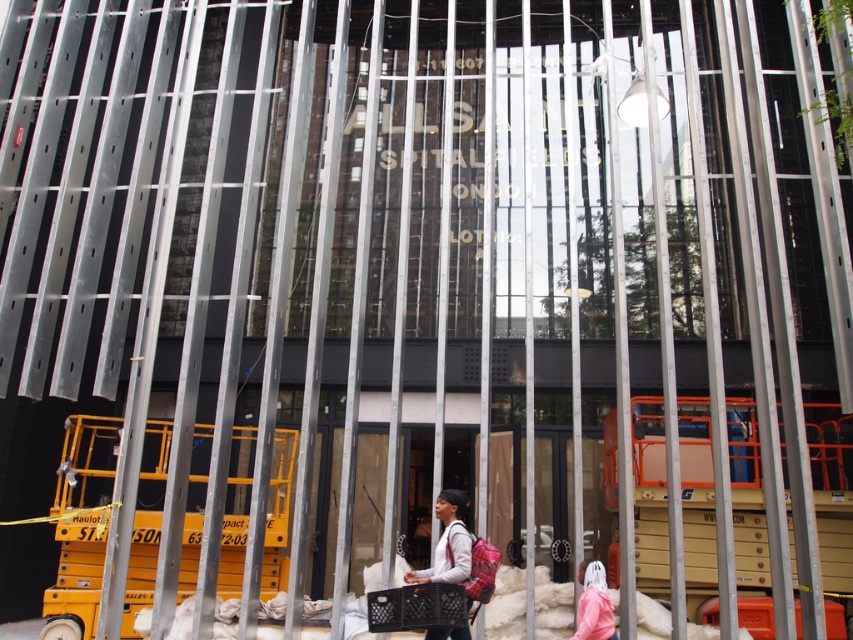
You are a delivery person who needs to carry a plaid fabric backpack at center and a pink fabric at lower right. Which item should you pick if you want to carry the smaller one?

The plaid fabric backpack at center is smaller than the pink fabric at lower right, so you should pick the plaid fabric backpack at center.

You are a worker at the construction site and need to place a tool box on the ground. You see a plaid fabric backpack at center and a pink fabric at lower right. Which surface would you choose to place the tool box if you want it to be higher off the ground?

The plaid fabric backpack at center is shorter than the pink fabric at lower right, so placing the tool box on the pink fabric at lower right would result in it being higher off the ground.

You are a worker on the construction site and need to carry your tools. You have a plaid fabric backpack at center and a pink fabric at lower right. Which item can you use to carry more items based on their size?

The pink fabric at lower right can carry more items because its width is greater than the plaid fabric backpack at center.